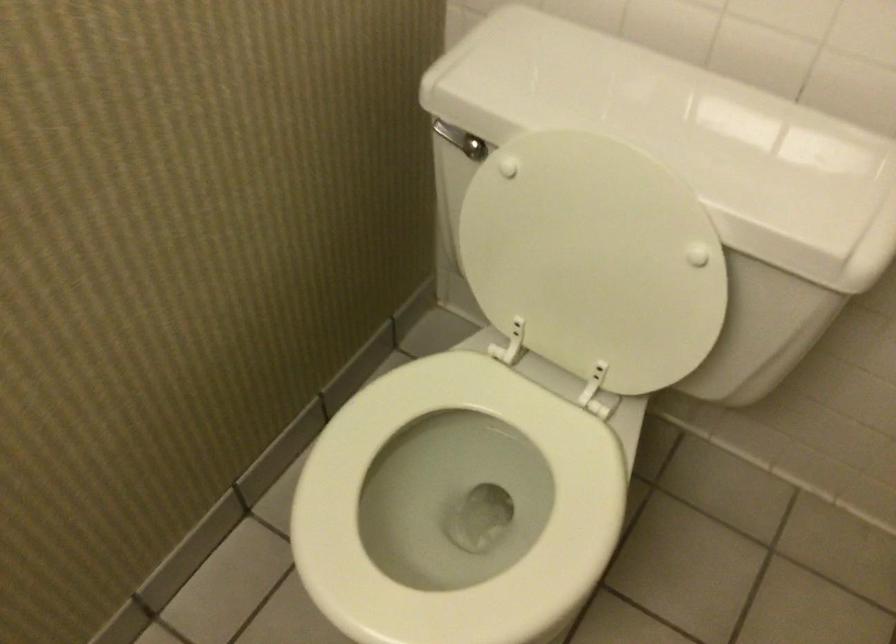
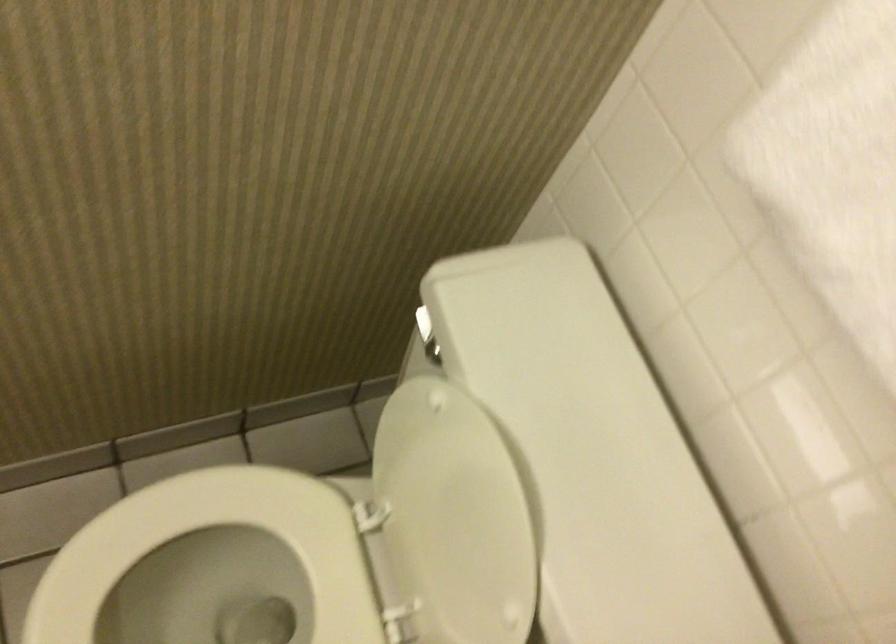
Locate, in the second image, the point that corresponds to the point at 428,515 in the first image.

(222, 590)